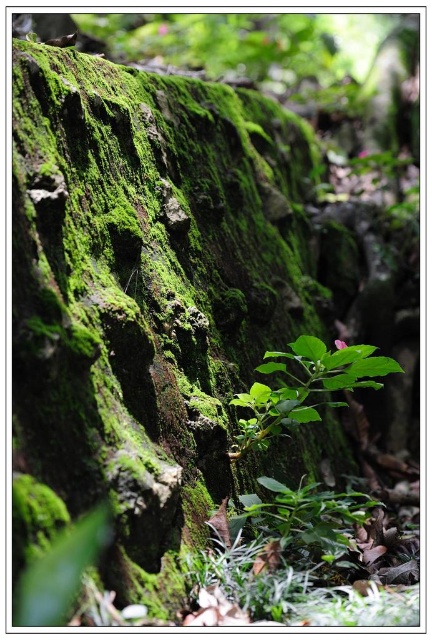
You are a photographer holding a camera. You want to capture a closeup of the green leafy plant at center. Can you move closer to the plant to get a better shot without exceeding the minimum focusing distance of your camera, which is 1.5 meters?

The distance between the green leafy plant at center and the camera is 1.46 meters, which is less than the camera minimum focusing distance of 1.5 meters. Therefore, you cannot move closer to the plant to get a better shot without exceeding the minimum focusing distance.